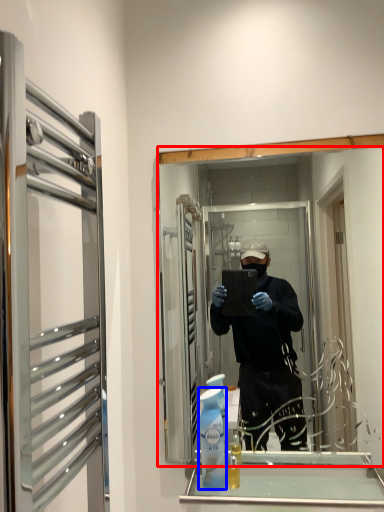
Question: Among these objects, which one is nearest to the camera, mirror (highlighted by a red box) or cleaning product (highlighted by a blue box)?

Choices:
 (A) mirror
 (B) cleaning product

Answer: (B)